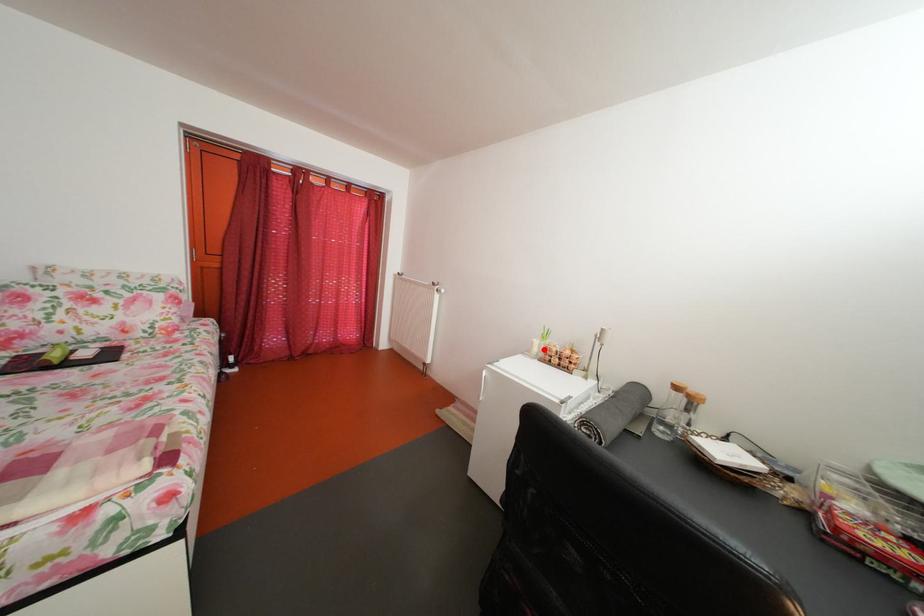
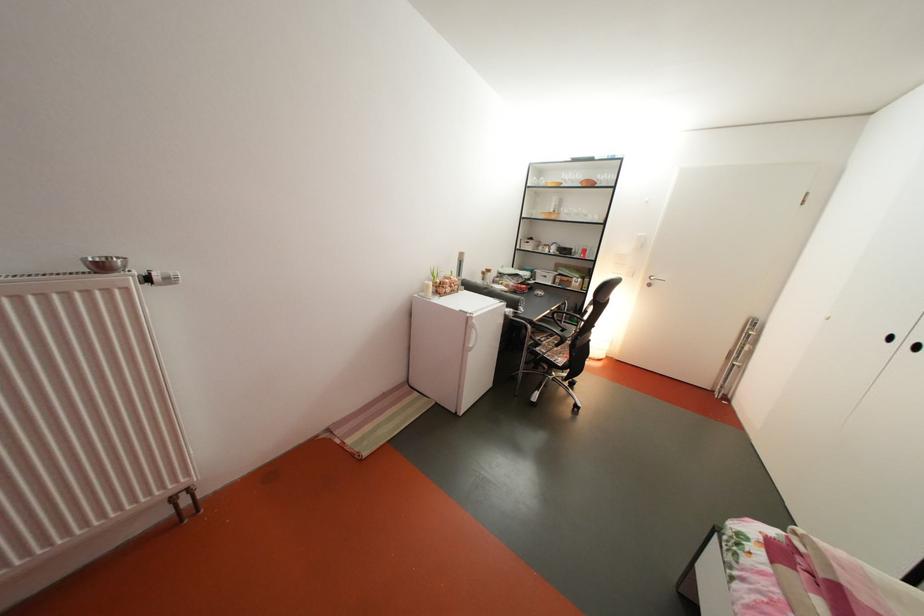
Question: I am providing you with two images of the same scene from different viewpoints. A red point is marked on the first image. Can you still see the location of the red point in image 2?

Choices:
 (A) Yes
 (B) No

Answer: (A)